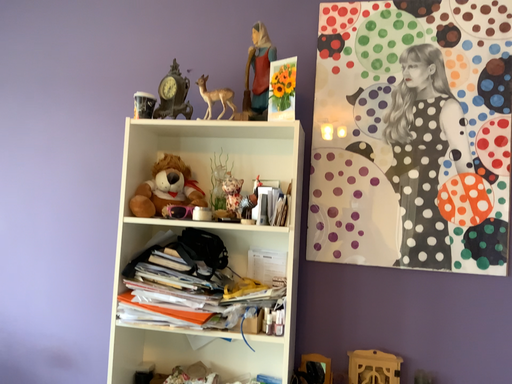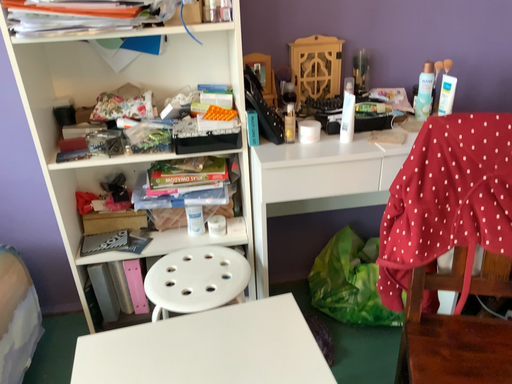
Question: Which way did the camera rotate in the video?

Choices:
 (A) rotated downward
 (B) rotated upward

Answer: (A)